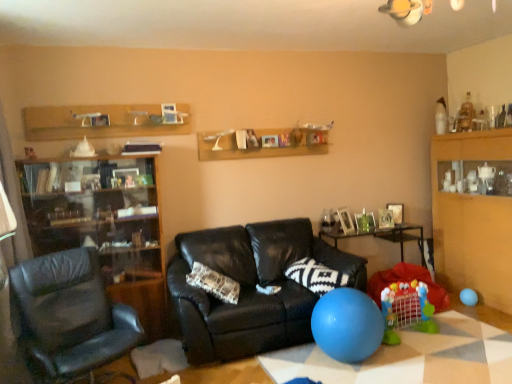
You are a GUI agent. You are given a task and a screenshot of the screen. Output one action in this format:
    pyautogui.click(x=<x>, y=<y>)
    Task: Click on the vacant area that lies in front of blue rubber balloon at lower right, which is the 2th balloon in front-to-back order
    
    Given the screenshot: What is the action you would take?
    pyautogui.click(x=481, y=309)